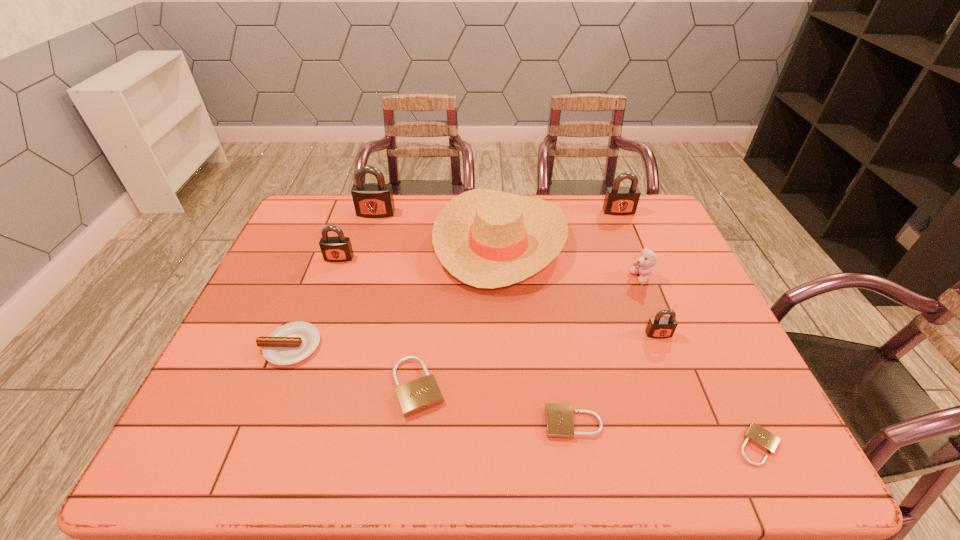
This screenshot has height=540, width=960. What are the coordinates of `the seventh tallest object` in the screenshot? It's located at pos(293,342).

The image size is (960, 540). In order to click on the leftmost beige padlock in this screenshot , I will do `click(418, 395)`.

Find the location of a particular element. the fifth tallest padlock is located at coordinates (418, 395).

Identify the location of the fourth padlock from right to left. (559, 418).

Where is `the second smallest beige padlock`? The width and height of the screenshot is (960, 540). the second smallest beige padlock is located at coordinates (559, 418).

Find the location of `the rightmost beige padlock`. the rightmost beige padlock is located at coordinates (760, 437).

This screenshot has height=540, width=960. Identify the location of the smallest beige padlock. (760, 437).

You are a GUI agent. You are given a task and a screenshot of the screen. Output one action in this format:
    pyautogui.click(x=<x>, y=<y>)
    Task: Click on the free space located 0.380m on the front of the tallest object near the keyhole
    The image size is (960, 540).
    Given the screenshot: What is the action you would take?
    pyautogui.click(x=350, y=299)

Locate an element on the screen. The height and width of the screenshot is (540, 960). vacant space located 0.200m on the front of the third smallest gray padlock near the keyhole is located at coordinates (636, 254).

This screenshot has height=540, width=960. I want to click on vacant space located on the front of the sunhat, so click(x=506, y=334).